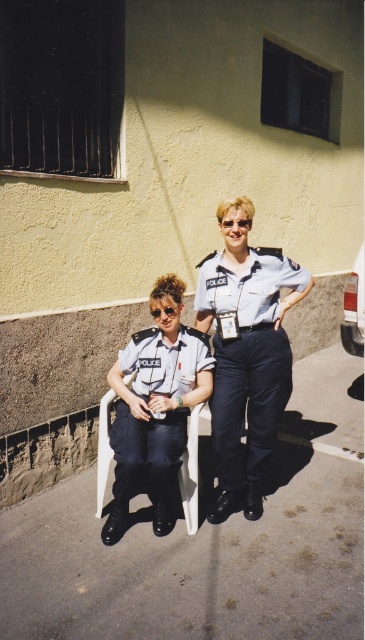
Can you confirm if light blue fabric uniform at center is positioned to the right of matte white uniform at center?

Yes, light blue fabric uniform at center is to the right of matte white uniform at center.

Is light blue fabric uniform at center positioned in front of matte white uniform at center?

No, it is not.

Is point (287, 365) in front of point (163, 342)?

That is True.

At what (x,y) coordinates should I click in order to perform the action: click on light blue fabric uniform at center. Please return your answer as a coordinate pair (x, y). This screenshot has height=640, width=365. Looking at the image, I should click on (247, 358).